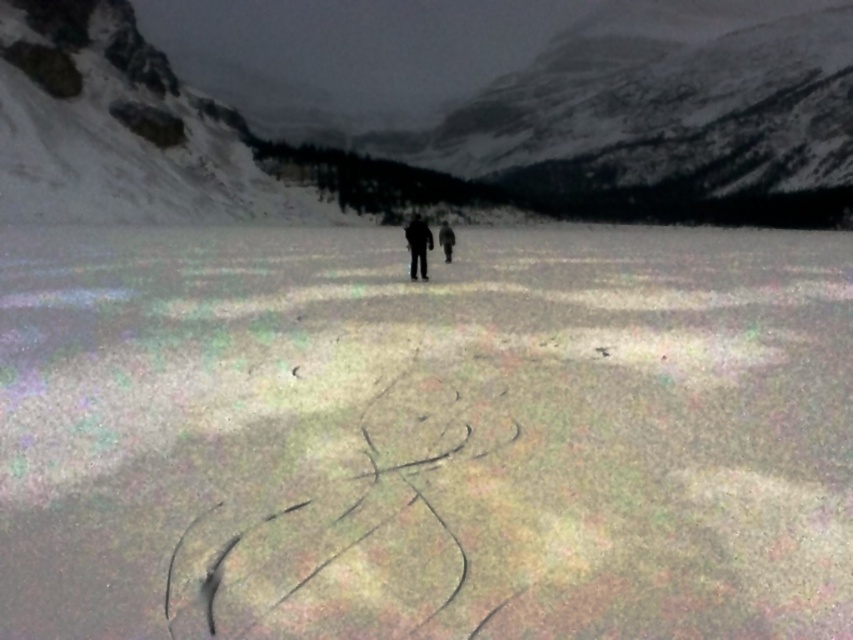
Question: Which point is closer to the camera?

Choices:
 (A) snowy granite mountain at upper center
 (B) black matte jacket at center

Answer: (B)

Question: Which of the following is the closest to the observer?

Choices:
 (A) (735, 129)
 (B) (258, 317)

Answer: (B)

Question: Which object appears closest to the camera in this image?

Choices:
 (A) white textured snow at center
 (B) dark fabric figure at center

Answer: (A)

Question: Does snowy granite mountain at upper center appear on the right side of dark fabric figure at center?

Choices:
 (A) no
 (B) yes

Answer: (B)

Question: Can you confirm if white textured snow at center is thinner than dark fabric figure at center?

Choices:
 (A) no
 (B) yes

Answer: (A)

Question: Is snowy granite mountain at upper center smaller than dark fabric figure at center?

Choices:
 (A) no
 (B) yes

Answer: (A)